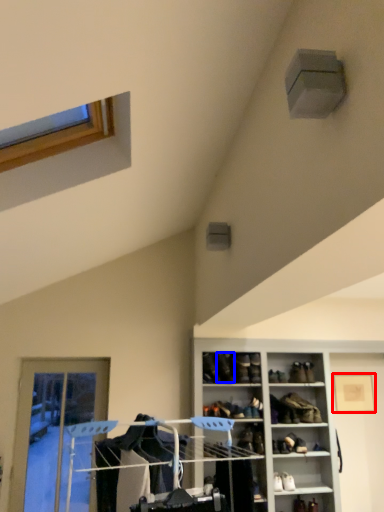
Question: Which of the following is the farthest to the observer, picture frame (highlighted by a red box) or shoe (highlighted by a blue box)?

Choices:
 (A) picture frame
 (B) shoe

Answer: (A)